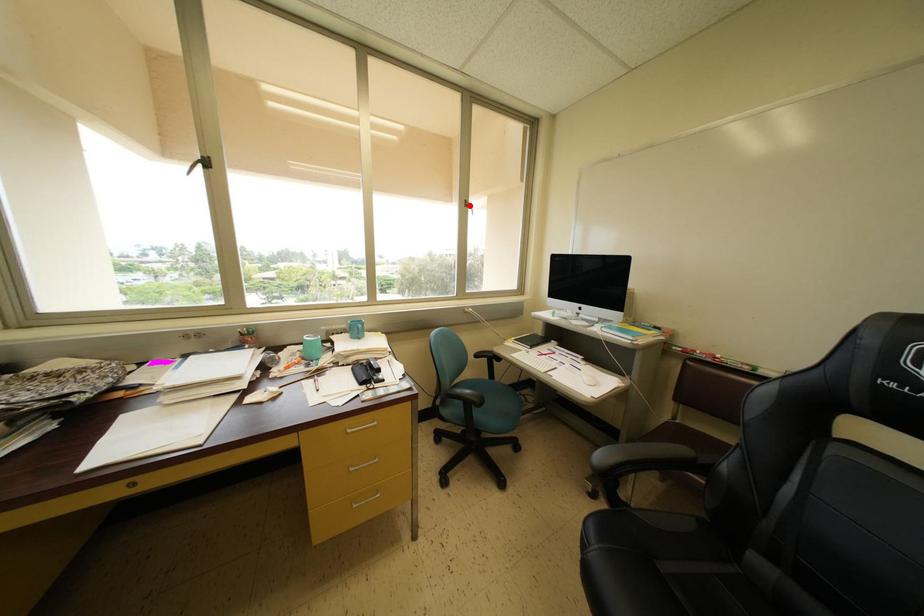
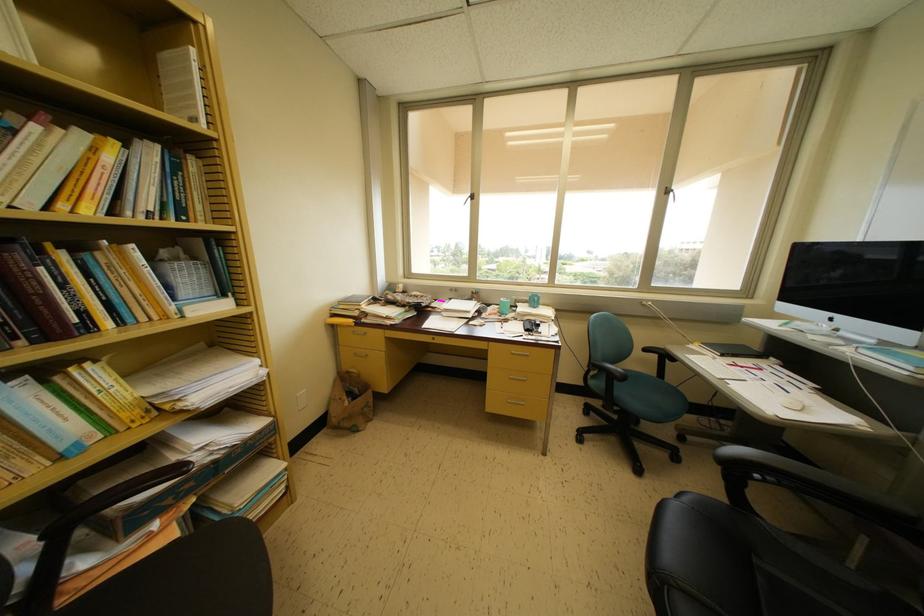
Question: I am providing you with two images of the same scene from different viewpoints. Given a red point in image1, look at the same physical point in image2. Is it:

Choices:
 (A) Closer to the viewpoint
 (B) Farther from the viewpoint

Answer: (B)